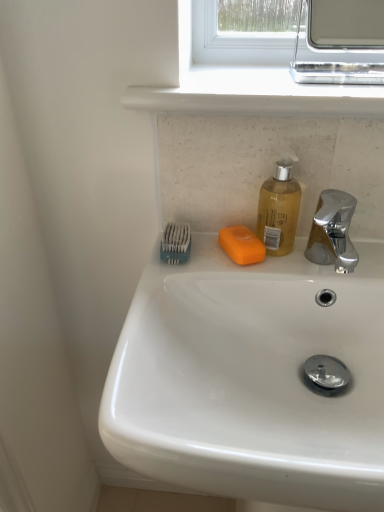
You are a GUI agent. You are given a task and a screenshot of the screen. Output one action in this format:
    pyautogui.click(x=<x>, y=<y>)
    Task: Click on the free spot in front of blue plastic toothbrush at upper left
    This screenshot has height=512, width=384.
    Given the screenshot: What is the action you would take?
    pyautogui.click(x=171, y=290)